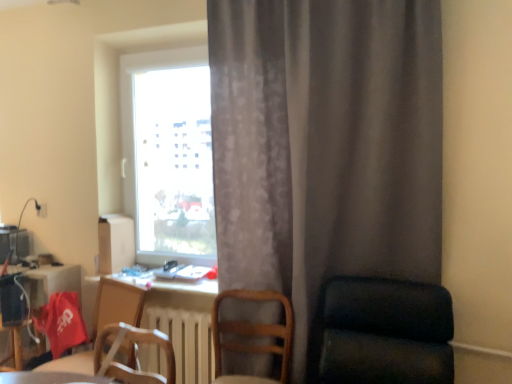
Question: From a real-world perspective, is matte black computer desk at lower left positioned above or below white glossy table at lower left?

Choices:
 (A) below
 (B) above

Answer: (A)

Question: Is matte black computer desk at lower left in front of or behind white glossy table at lower left in the image?

Choices:
 (A) front
 (B) behind

Answer: (B)

Question: Which of these objects is positioned closest to the matte black computer desk at lower left?

Choices:
 (A) white glossy table at lower left
 (B) wooden chair at lower left, the 3th chair when ordered from right to left
 (C) gray textured curtain at center
 (D) transparent glass window at center
 (E) dark green fabric chair at right, which appears as the first chair when viewed from the right

Answer: (B)

Question: Which object is positioned closest to the white wooden radiator at center?

Choices:
 (A) wooden chair at lower center, the second chair from the left
 (B) matte black computer desk at lower left
 (C) wooden chair at lower left, which appears as the 1th chair when viewed from the left
 (D) white glossy table at lower left
 (E) gray textured curtain at center

Answer: (A)